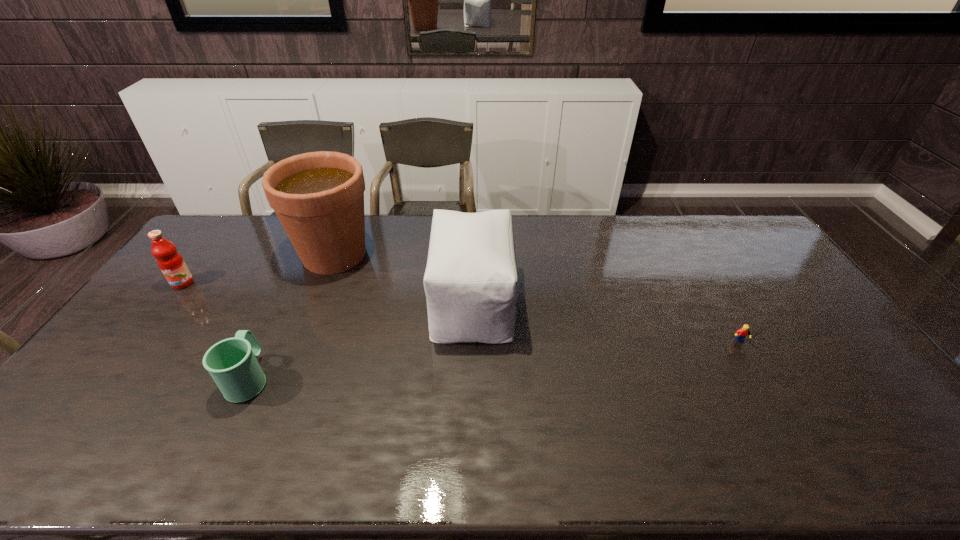
Where is `vacant space located on the side of the second tallest object with the smiley face`? The width and height of the screenshot is (960, 540). vacant space located on the side of the second tallest object with the smiley face is located at coordinates (590, 301).

The width and height of the screenshot is (960, 540). What are the coordinates of `free region located on the front label of the third shortest object` in the screenshot? It's located at pos(138,342).

Locate an element on the screen. This screenshot has height=540, width=960. vacant area located 0.200m on the side of the fourth tallest object with the handle is located at coordinates (x=284, y=305).

Where is `vacant space located on the side of the fourth tallest object with the handle`? vacant space located on the side of the fourth tallest object with the handle is located at coordinates (299, 275).

The height and width of the screenshot is (540, 960). What are the coordinates of `blank space located on the side of the fourth tallest object with the handle` in the screenshot? It's located at (279, 316).

Where is `blank area located 0.330m on the front-facing side of the rightmost object`? The height and width of the screenshot is (540, 960). blank area located 0.330m on the front-facing side of the rightmost object is located at coordinates (811, 464).

Find the location of a particular element. The image size is (960, 540). object that is at the far edge is located at coordinates (318, 197).

This screenshot has height=540, width=960. In order to click on object located in the left edge section of the desktop in this screenshot , I will do `click(171, 263)`.

The image size is (960, 540). In order to click on vacant space at the far edge in this screenshot , I will do `click(518, 245)`.

Locate an element on the screen. The image size is (960, 540). free spot at the near edge of the desktop is located at coordinates (690, 441).